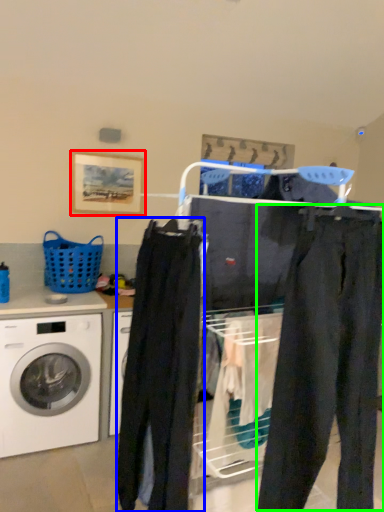
Question: Based on their relative distances, which object is farther from picture frame (highlighted by a red box)? Choose from clothing (highlighted by a blue box) and pants (highlighted by a green box).

Choices:
 (A) clothing
 (B) pants

Answer: (B)